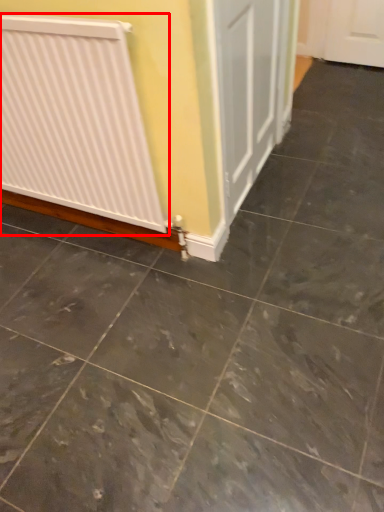
Question: From the image's perspective, what is the correct spatial positioning of radiator (annotated by the red box) in reference to concrete?

Choices:
 (A) above
 (B) below

Answer: (A)